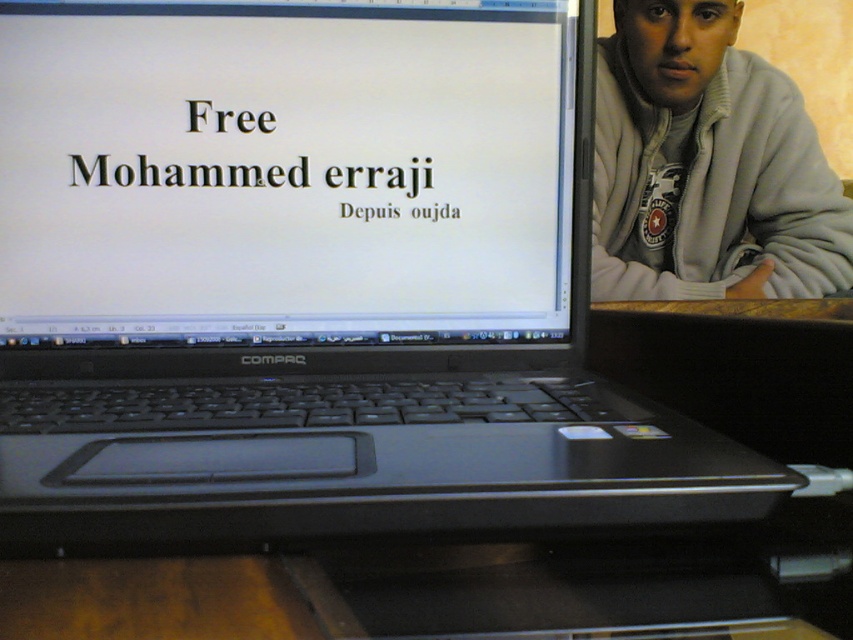
Question: Does white matte screen at center appear on the right side of gray fleece jacket at upper right?

Choices:
 (A) no
 (B) yes

Answer: (A)

Question: Is white matte screen at center above gray fleece jacket at upper right?

Choices:
 (A) yes
 (B) no

Answer: (B)

Question: Which object is closer to the camera taking this photo?

Choices:
 (A) white matte screen at center
 (B) gray fleece jacket at upper right

Answer: (A)

Question: Which of the following is the farthest from the observer?

Choices:
 (A) (233, 115)
 (B) (660, 35)

Answer: (B)

Question: Can you confirm if white matte screen at center is thinner than gray fleece jacket at upper right?

Choices:
 (A) yes
 (B) no

Answer: (A)

Question: Which object appears closest to the camera in this image?

Choices:
 (A) white matte screen at center
 (B) gray fleece jacket at upper right

Answer: (A)